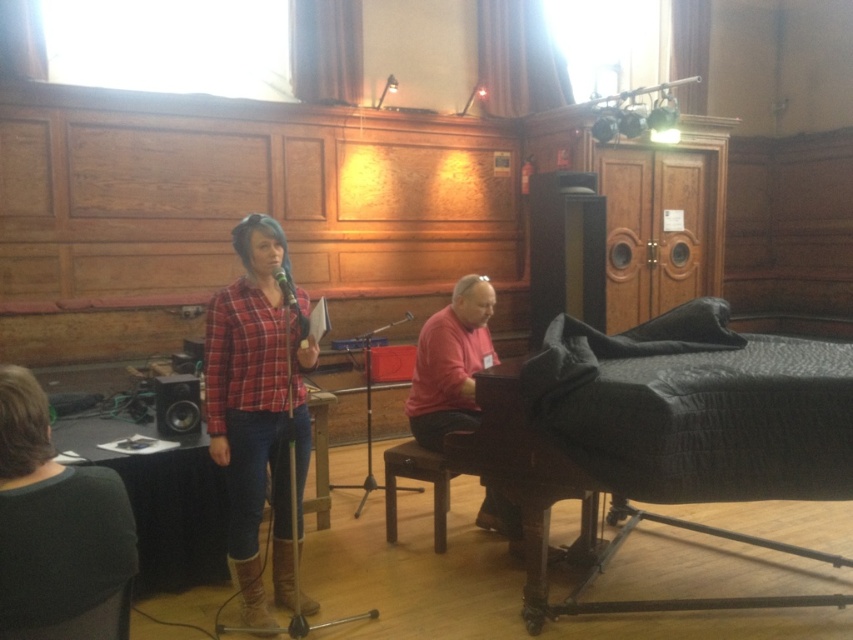
You are an event planner setting up for a performance. You see the black textured piano at right and the pink matte shirt at center. Which object is positioned closer to the audience sitting in front?

The black textured piano at right is closer to the audience because it is nearer to the viewer compared to the pink matte shirt at center.

You are an event organizer planning to place two shirts on a display rack. The plaid shirt at center and the pink matte shirt at center. Given their sizes, which shirt should be placed on the higher shelf to ensure they are both visible?

The plaid shirt at center is much taller than the pink matte shirt at center, so placing the plaid shirt at center on the higher shelf would ensure both are visible.

You are an event organizer who needs to arrange two shirts for a display. The plaid shirt at center and the pink matte shirt at center are both in the image. Which shirt should you place on the left side of the display to match the image?

The plaid shirt at center should be placed on the left side of the display because in the image, the plaid shirt at center is to the left of the pink matte shirt at center.